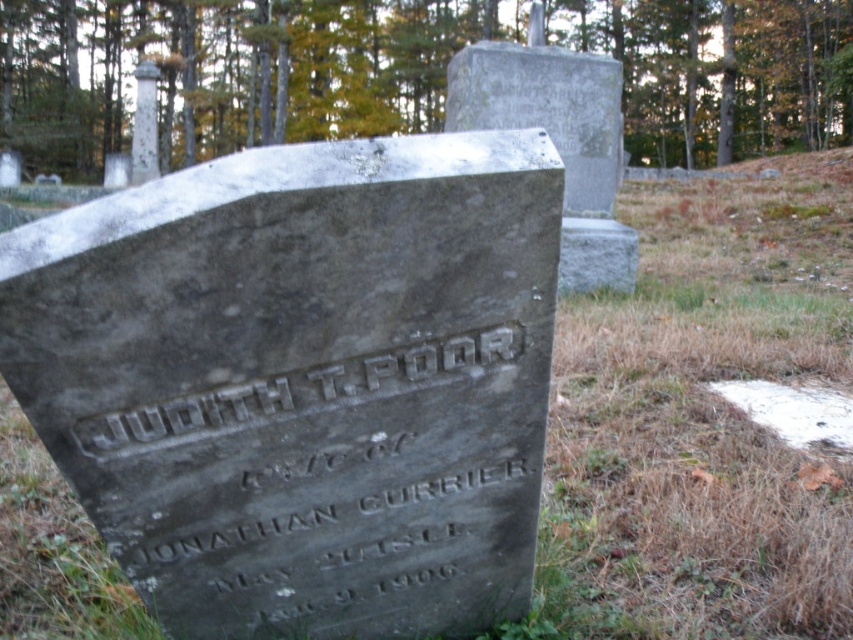
You are standing in front of the gravestone and want to read the etched stone nameplate at center. However, there is a green leafy tree at upper center blocking your view. Can you move around the tree to see the nameplate?

The etched stone nameplate at center is behind the green leafy tree at upper center, so moving around the tree might allow you to see the nameplate.